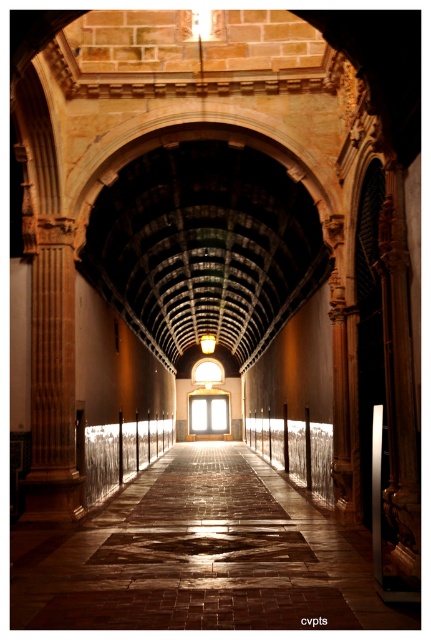
Question: Among these objects, which one is nearest to the camera?

Choices:
 (A) wooden column at left
 (B) clear glass rail at center
 (C) silver metallic rail at center
 (D) brown stone floor at center

Answer: (D)

Question: Is wooden column at left wider than clear glass rail at center?

Choices:
 (A) no
 (B) yes

Answer: (B)

Question: Estimate the real-world distances between objects in this image. Which object is farther from the brown stone floor at center?

Choices:
 (A) silver metallic rail at center
 (B) wooden column at left
 (C) clear glass rail at center

Answer: (C)

Question: Is silver metallic rail at center positioned before clear glass rail at center?

Choices:
 (A) yes
 (B) no

Answer: (B)

Question: Which of the following is the closest to the observer?

Choices:
 (A) (109, 449)
 (B) (72, 314)
 (C) (274, 467)

Answer: (B)

Question: Does silver metallic rail at center come in front of clear glass rail at center?

Choices:
 (A) no
 (B) yes

Answer: (A)